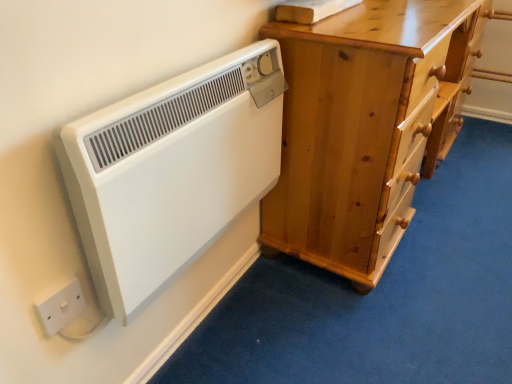
Where is `free space in front of light brown wooden chest of drawers at right`? This screenshot has width=512, height=384. free space in front of light brown wooden chest of drawers at right is located at coordinates 397,286.